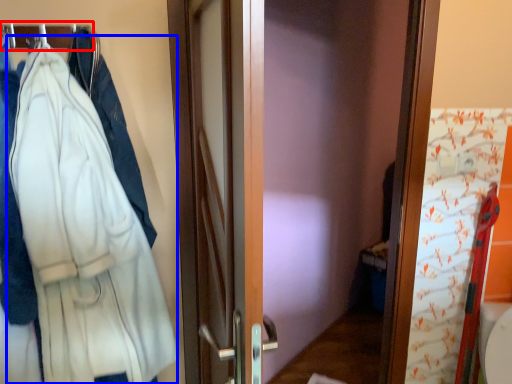
Question: Which point is closer to the camera, hanger (highlighted by a red box) or bathrobe (highlighted by a blue box)?

Choices:
 (A) hanger
 (B) bathrobe

Answer: (B)